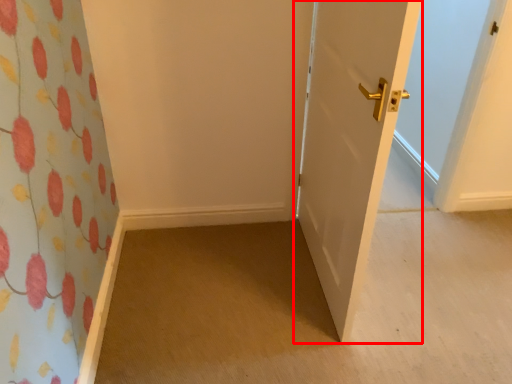
Question: From the image's perspective, what is the correct spatial relationship of door (annotated by the red box) in relation to plain?

Choices:
 (A) below
 (B) above

Answer: (B)